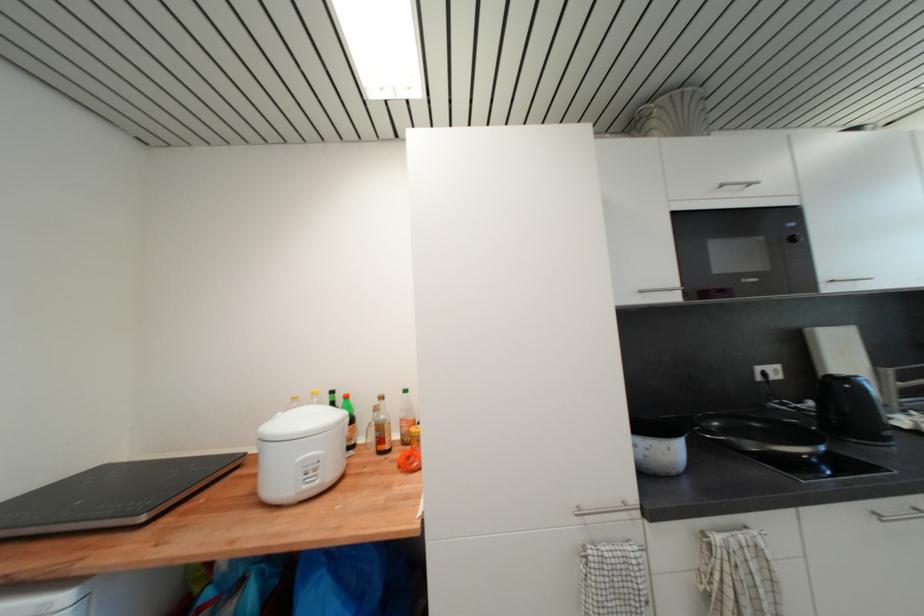
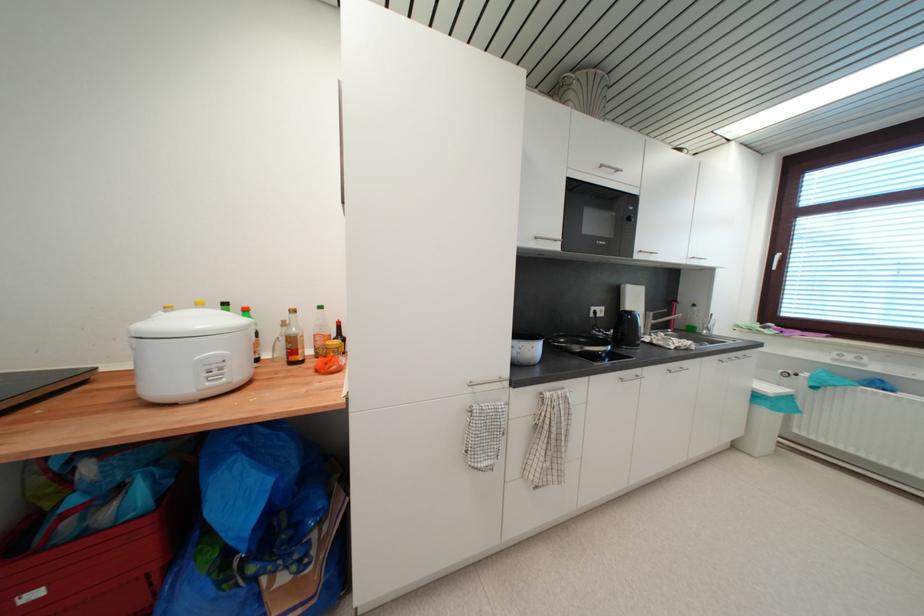
In the second image, find the point that corresponds to [881,516] in the first image.

(626, 381)